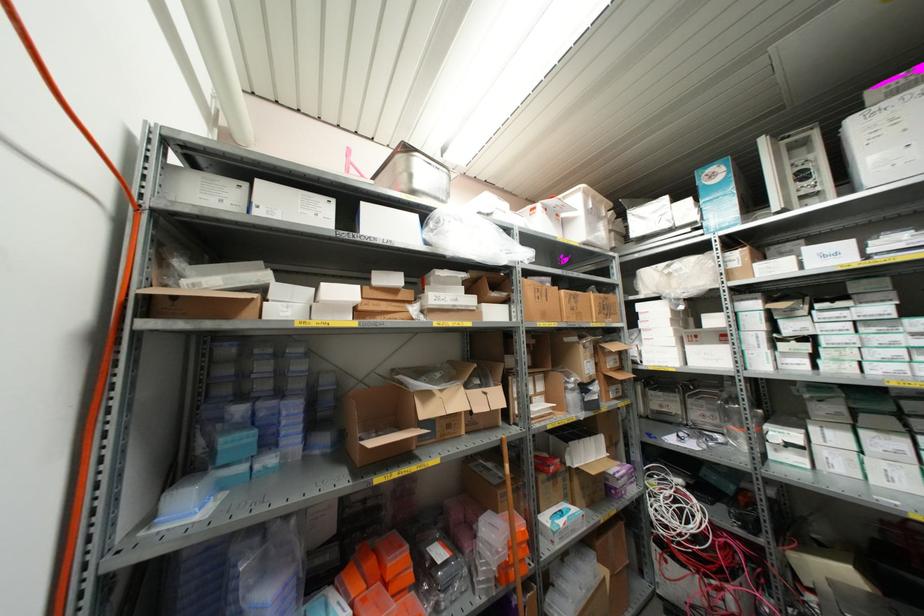
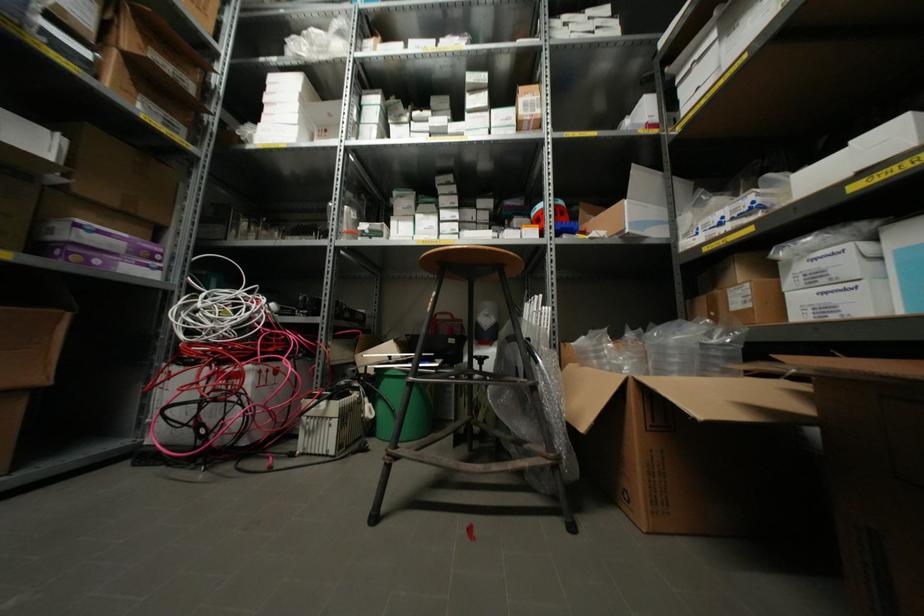
Locate, in the second image, the point that corresponds to point 671,339 in the first image.

(293, 116)